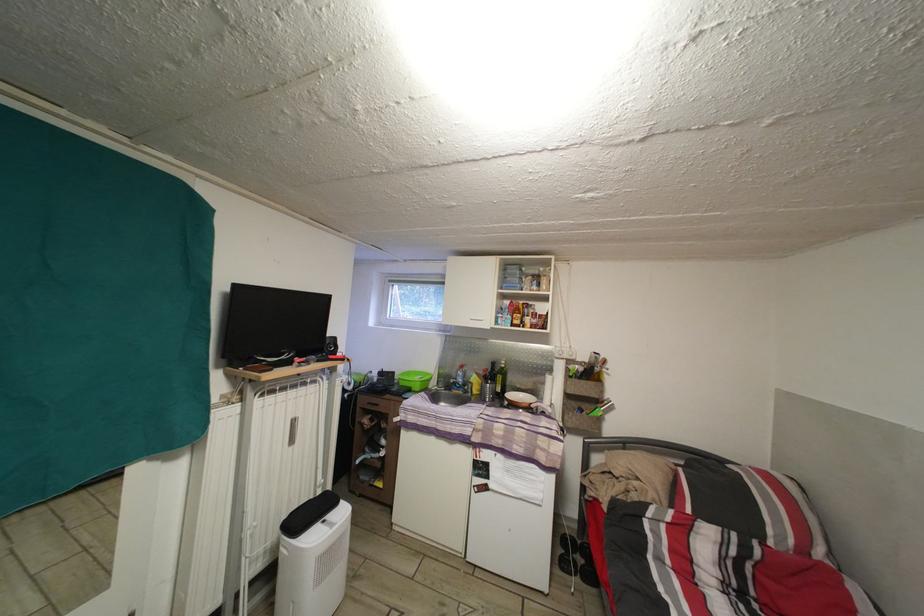
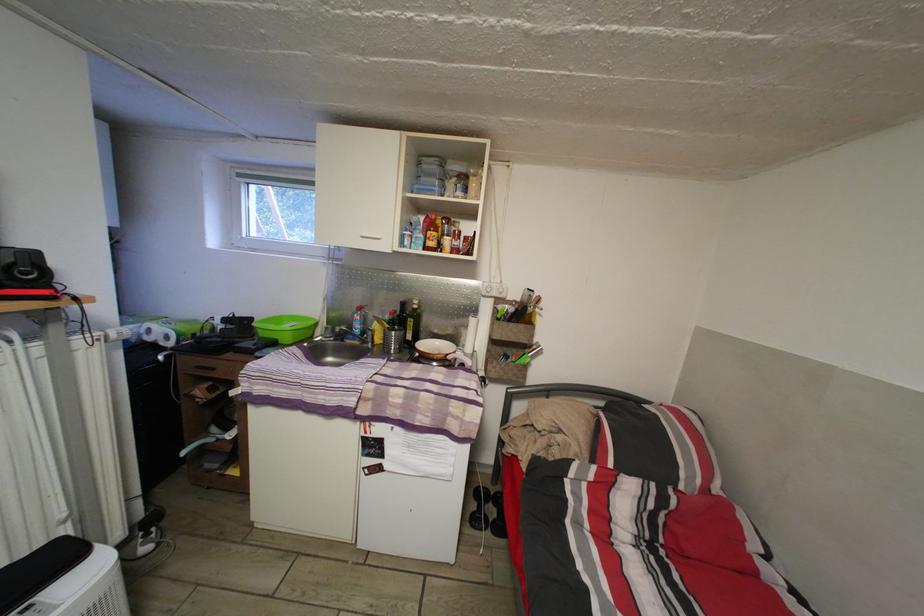
In the second image, find the point that corresponds to pixel 505 397 in the first image.

(417, 344)